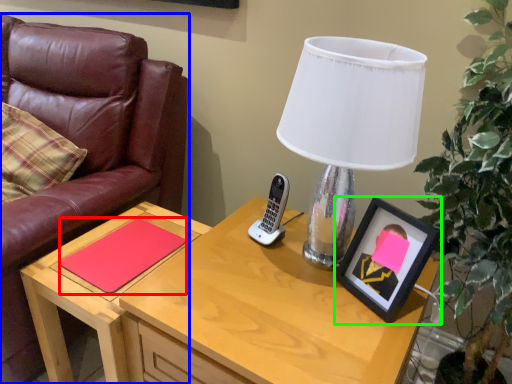
Question: Estimate the real-world distances between objects in this image. Which object is farther from notepad (highlighted by a red box), chair (highlighted by a blue box) or picture frame (highlighted by a green box)?

Choices:
 (A) chair
 (B) picture frame

Answer: (B)